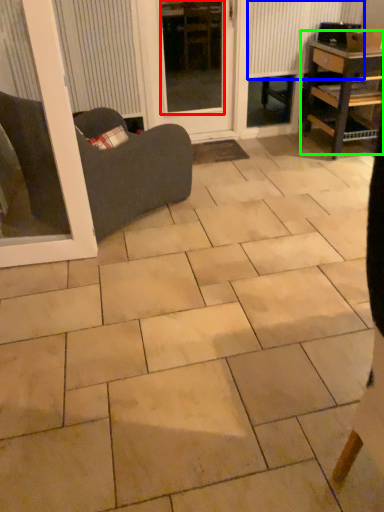
Question: Based on their relative distances, which object is farther from window screen (highlighted by a red box)? Choose from radiator (highlighted by a blue box) and table (highlighted by a green box).

Choices:
 (A) radiator
 (B) table

Answer: (B)